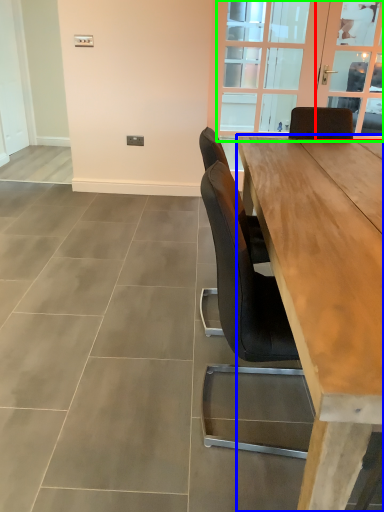
Question: Which is nearer to the window screen (highlighted by a red box)? table (highlighted by a blue box) or window (highlighted by a green box).

Choices:
 (A) table
 (B) window

Answer: (B)